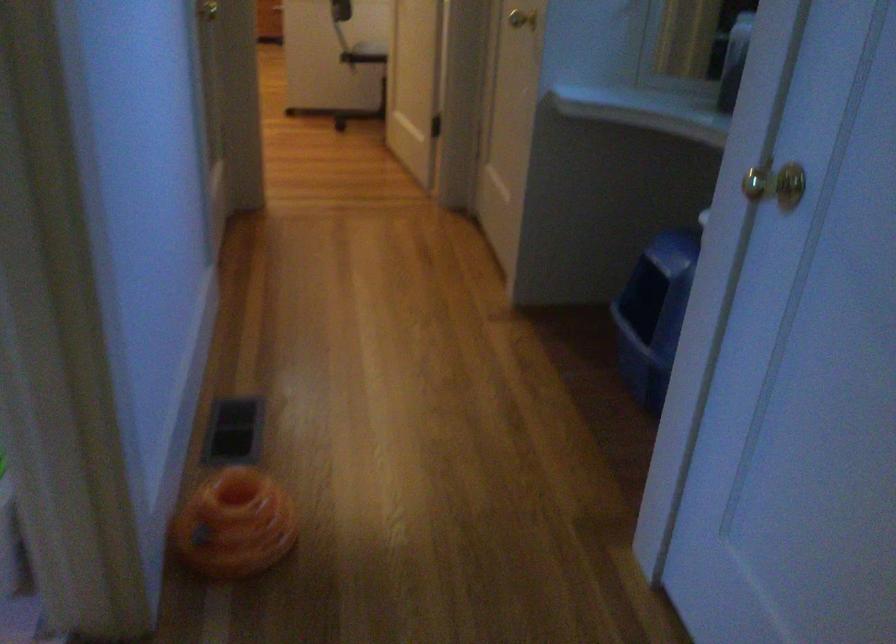
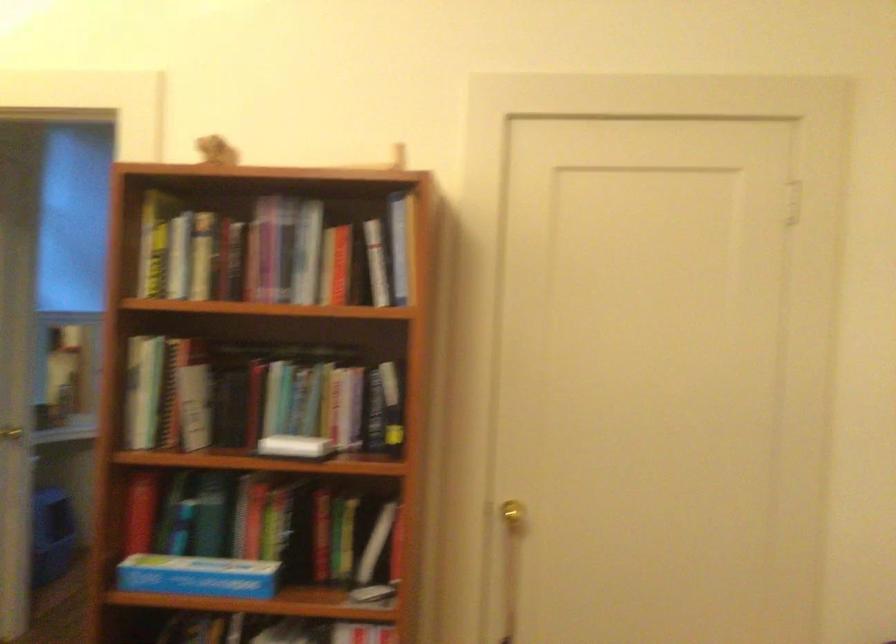
Question: I am providing you with two images of the same scene from different viewpoints. Which of the following objects are not visible in image2?

Choices:
 (A) small brown figurine
 (B) Light blue bowl
 (C) silver door knob
 (D) orange cat toy

Answer: (D)